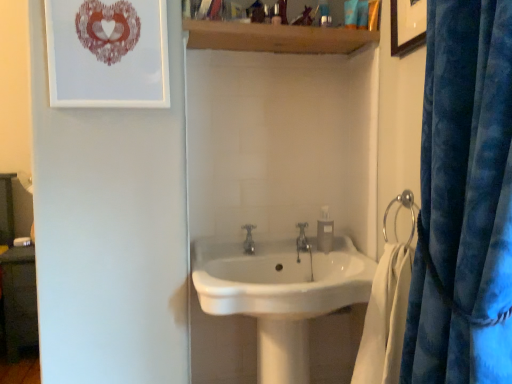
Question: Is silver metallic towel ring at right surrounded by white soft towel at lower right?

Choices:
 (A) no
 (B) yes

Answer: (A)

Question: Does white soft towel at lower right have a larger size compared to silver metallic towel ring at right?

Choices:
 (A) no
 (B) yes

Answer: (B)

Question: Is white soft towel at lower right closer to camera compared to silver metallic towel ring at right?

Choices:
 (A) no
 (B) yes

Answer: (B)

Question: Considering the relative positions of white soft towel at lower right and silver metallic towel ring at right in the image provided, is white soft towel at lower right behind silver metallic towel ring at right?

Choices:
 (A) yes
 (B) no

Answer: (B)

Question: Can you confirm if white soft towel at lower right is thinner than silver metallic towel ring at right?

Choices:
 (A) no
 (B) yes

Answer: (A)

Question: From a real-world perspective, is clear plastic soap dispenser at center above or below wooden shelf at upper center?

Choices:
 (A) below
 (B) above

Answer: (A)

Question: Is point (316, 238) closer or farther from the camera than point (238, 43)?

Choices:
 (A) farther
 (B) closer

Answer: (A)

Question: Considering their positions, is clear plastic soap dispenser at center located in front of or behind wooden shelf at upper center?

Choices:
 (A) front
 (B) behind

Answer: (B)

Question: In the image, is clear plastic soap dispenser at center on the left side or the right side of wooden shelf at upper center?

Choices:
 (A) right
 (B) left

Answer: (A)

Question: Is velvet blue curtain at right bigger or smaller than white soft towel at lower right?

Choices:
 (A) big
 (B) small

Answer: (A)

Question: Is velvet blue curtain at right taller or shorter than white soft towel at lower right?

Choices:
 (A) short
 (B) tall

Answer: (B)

Question: Considering the positions of point (479, 354) and point (385, 331), is point (479, 354) closer or farther from the camera than point (385, 331)?

Choices:
 (A) closer
 (B) farther

Answer: (A)

Question: From the image's perspective, relative to white soft towel at lower right, is velvet blue curtain at right above or below?

Choices:
 (A) below
 (B) above

Answer: (B)

Question: Considering the positions of point (98, 4) and point (306, 306), is point (98, 4) closer or farther from the camera than point (306, 306)?

Choices:
 (A) closer
 (B) farther

Answer: (B)

Question: From the image's perspective, is matte paper picture frame at upper left, the 1th picture frame positioned from the left, above or below white glossy sink at center?

Choices:
 (A) above
 (B) below

Answer: (A)